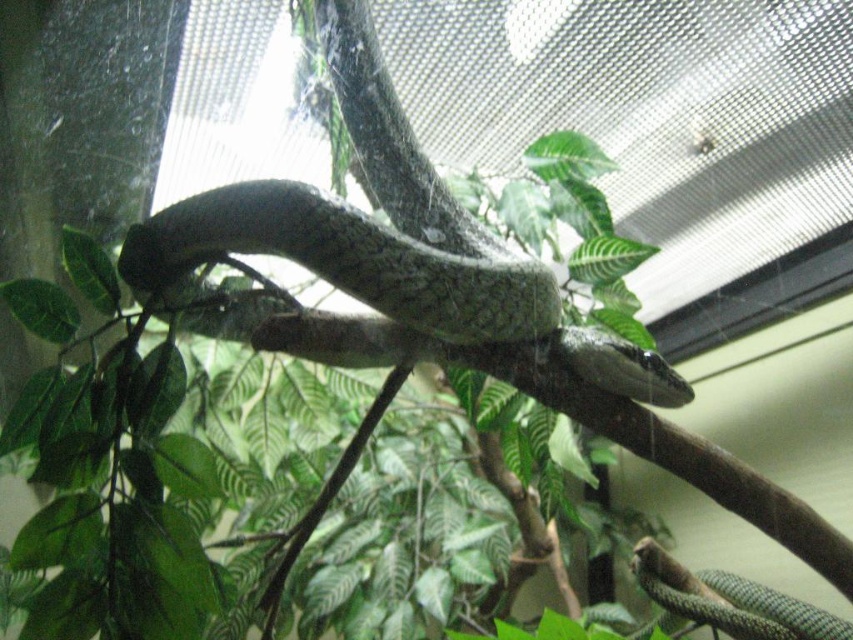
You are a researcher observing the terrarium. There is a point at coordinates (389, 237). Which object in the terrarium does this point lie on?

The point at coordinates (389, 237) lies on the green scaly snake at center.

You are a zookeeper tasked with feeding the reptiles in the enclosure. You have two containers of food, one for larger snakes and one for smaller ones. You see the green scaly snake at center and the green glossy snake at lower right. Which snake should you feed with the larger container?

The green scaly snake at center is larger in size than the green glossy snake at lower right, so you should feed the green scaly snake at center with the larger container.

Looking at this image, you are standing in front of the terrarium and notice a specific point at coordinates point (x=293, y=237). If your arm can reach up to 5 feet, can you touch that point?

The distance of point (x=293, y=237) from viewer is 5.37 feet, so no, you cannot touch it because it is slightly farther than your arm can reach.